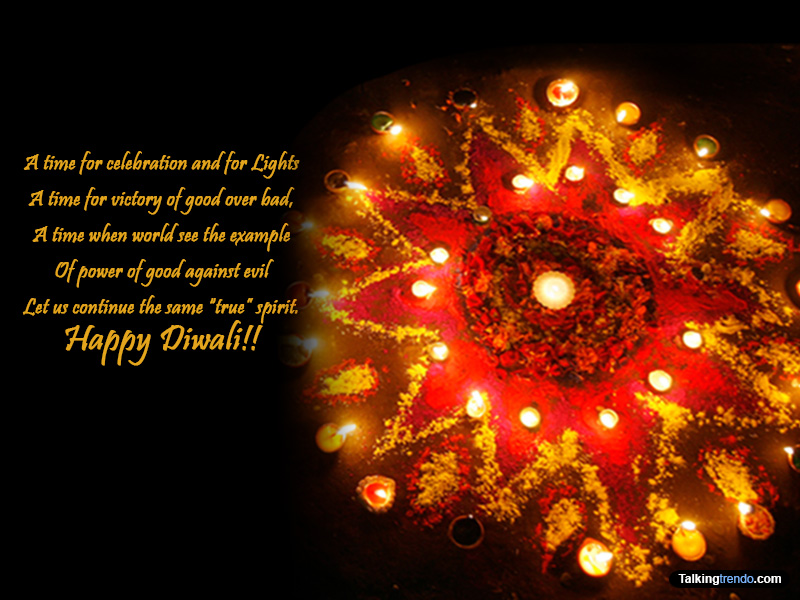
Find the location of `candle`. candle is located at coordinates (562, 295).